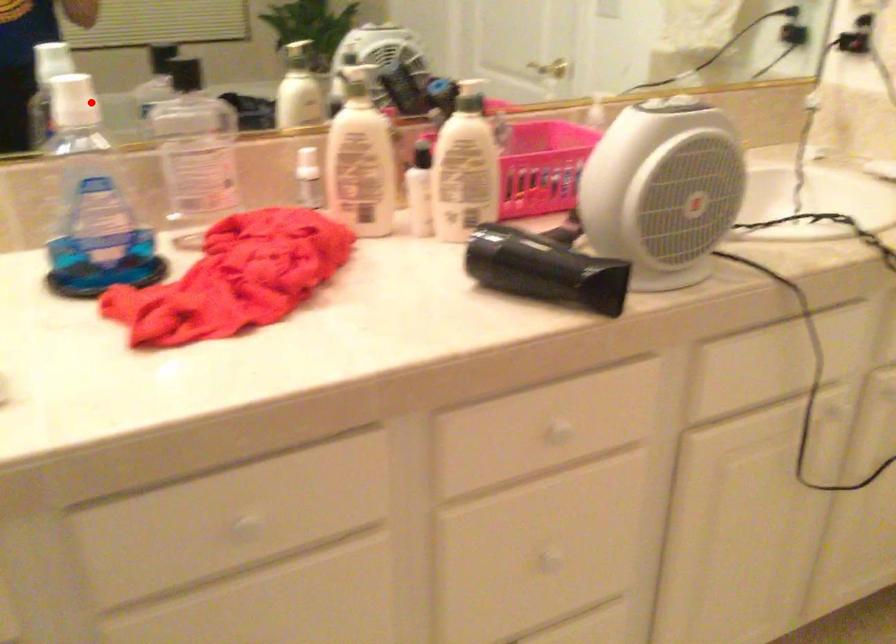
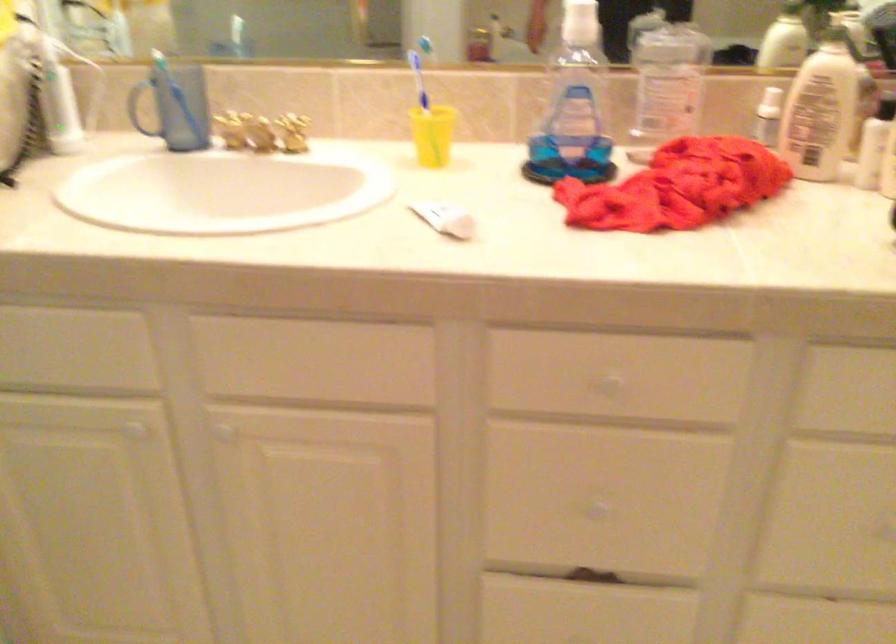
The point at the highlighted location is marked in the first image. Where is the corresponding point in the second image?

(583, 24)